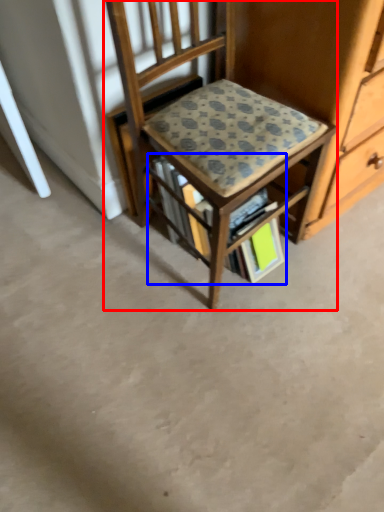
Question: Which of the following is the closest to the observer, chair (highlighted by a red box) or book (highlighted by a blue box)?

Choices:
 (A) chair
 (B) book

Answer: (A)